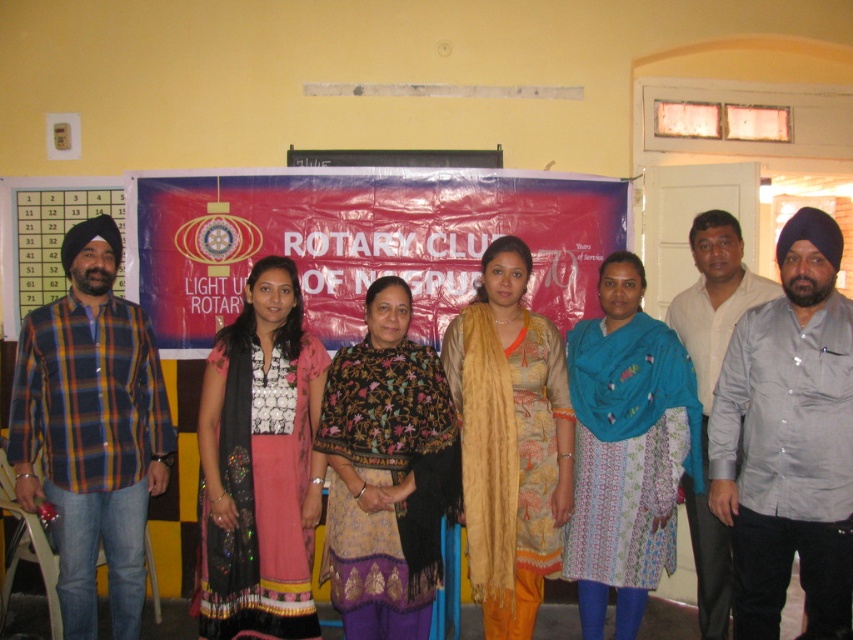
Question: Considering the real-world distances, which object is closest to the printed fabric shawl at center?

Choices:
 (A) gray satin shirt at center
 (B) beige textured scarf at center
 (C) blue printed dress at center
 (D) plaid flannel shirt at left

Answer: (B)

Question: Among these objects, which one is farthest from the camera?

Choices:
 (A) printed fabric shawl at center
 (B) gray satin shirt at center

Answer: (A)

Question: Is beige textured scarf at center positioned behind light beige shirt at center?

Choices:
 (A) yes
 (B) no

Answer: (B)

Question: Is printed fabric shawl at center wider than beige textured scarf at center?

Choices:
 (A) yes
 (B) no

Answer: (A)

Question: Which point is farther to the camera?

Choices:
 (A) matte black dress at center
 (B) plaid flannel shirt at left
 (C) printed fabric shawl at center
 (D) beige textured scarf at center

Answer: (D)

Question: Is plaid flannel shirt at left closer to camera compared to printed fabric shawl at center?

Choices:
 (A) no
 (B) yes

Answer: (A)